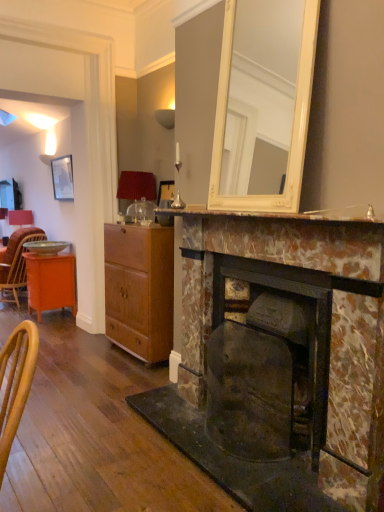
Question: Is orange wood desk at left outside of matte black picture frame at upper left?

Choices:
 (A) yes
 (B) no

Answer: (A)

Question: From a real-world perspective, is orange wood desk at left physically above matte black picture frame at upper left?

Choices:
 (A) yes
 (B) no

Answer: (B)

Question: Is orange wood desk at left shorter than matte black picture frame at upper left?

Choices:
 (A) yes
 (B) no

Answer: (B)

Question: Does orange wood desk at left appear on the left side of matte black picture frame at upper left?

Choices:
 (A) no
 (B) yes

Answer: (B)

Question: Is the position of orange wood desk at left more distant than that of matte black picture frame at upper left?

Choices:
 (A) yes
 (B) no

Answer: (B)

Question: Is orange wood desk at left spatially inside matte red lampshade at center, or outside of it?

Choices:
 (A) inside
 (B) outside

Answer: (B)

Question: Does point pyautogui.click(x=26, y=264) appear closer or farther from the camera than point pyautogui.click(x=125, y=193)?

Choices:
 (A) farther
 (B) closer

Answer: (A)

Question: In terms of width, does orange wood desk at left look wider or thinner when compared to matte red lampshade at center?

Choices:
 (A) wide
 (B) thin

Answer: (A)

Question: From the image's perspective, is orange wood desk at left above or below matte red lampshade at center?

Choices:
 (A) above
 (B) below

Answer: (B)

Question: Considering their positions, is wooden cabinet at center located in front of or behind matte black picture frame at upper left?

Choices:
 (A) behind
 (B) front

Answer: (B)

Question: From a real-world perspective, is wooden cabinet at center physically located above or below matte black picture frame at upper left?

Choices:
 (A) below
 (B) above

Answer: (A)

Question: Is wooden cabinet at center spatially inside matte black picture frame at upper left, or outside of it?

Choices:
 (A) outside
 (B) inside

Answer: (A)

Question: From the image's perspective, is wooden cabinet at center positioned above or below matte black picture frame at upper left?

Choices:
 (A) below
 (B) above

Answer: (A)

Question: Considering their positions, is marble mantelpiece at center located in front of or behind orange wood desk at left?

Choices:
 (A) front
 (B) behind

Answer: (A)

Question: Is point (228, 215) closer or farther from the camera than point (72, 283)?

Choices:
 (A) farther
 (B) closer

Answer: (B)